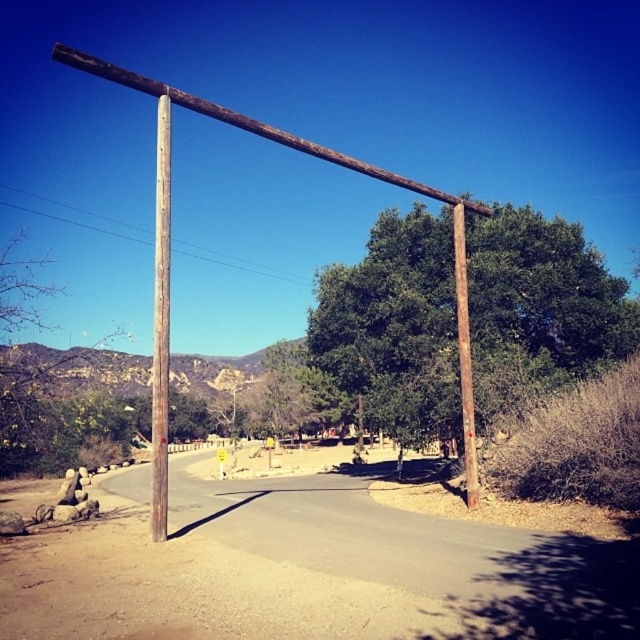
Question: Which of these objects is positioned closest to the brown rough wooden pole at right?

Choices:
 (A) brown wooden pole at left
 (B) brown rough wooden pole at upper center

Answer: (A)

Question: Is brown wooden pole at left smaller than brown rough wooden pole at right?

Choices:
 (A) yes
 (B) no

Answer: (B)

Question: Which object is positioned farthest from the brown wooden pole at left?

Choices:
 (A) brown rough wooden pole at upper center
 (B) brown rough wooden pole at right

Answer: (B)

Question: Based on their relative distances, which object is farther from the brown wooden pole at left?

Choices:
 (A) brown rough wooden pole at upper center
 (B) brown rough wooden pole at right

Answer: (B)

Question: Is brown rough wooden pole at upper center to the right of brown wooden pole at left from the viewer's perspective?

Choices:
 (A) no
 (B) yes

Answer: (B)

Question: Is brown rough wooden pole at upper center thinner than brown rough wooden pole at right?

Choices:
 (A) no
 (B) yes

Answer: (A)